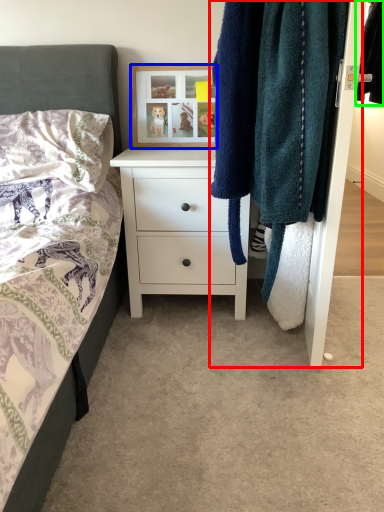
Question: Which is nearer to the closet (highlighted by a red box)? picture frame (highlighted by a blue box) or clothing (highlighted by a green box).

Choices:
 (A) picture frame
 (B) clothing

Answer: (B)